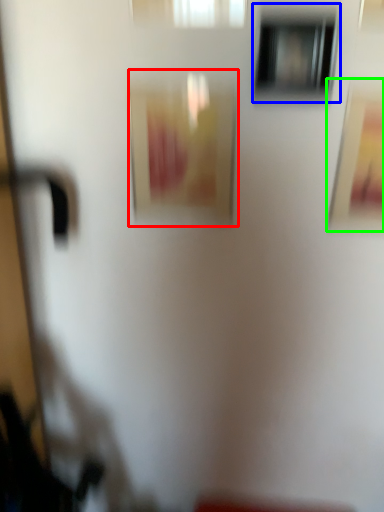
Question: Estimate the real-world distances between objects in this image. Which object is closer to picture frame (highlighted by a red box), window (highlighted by a blue box) or picture frame (highlighted by a green box)?

Choices:
 (A) window
 (B) picture frame

Answer: (A)